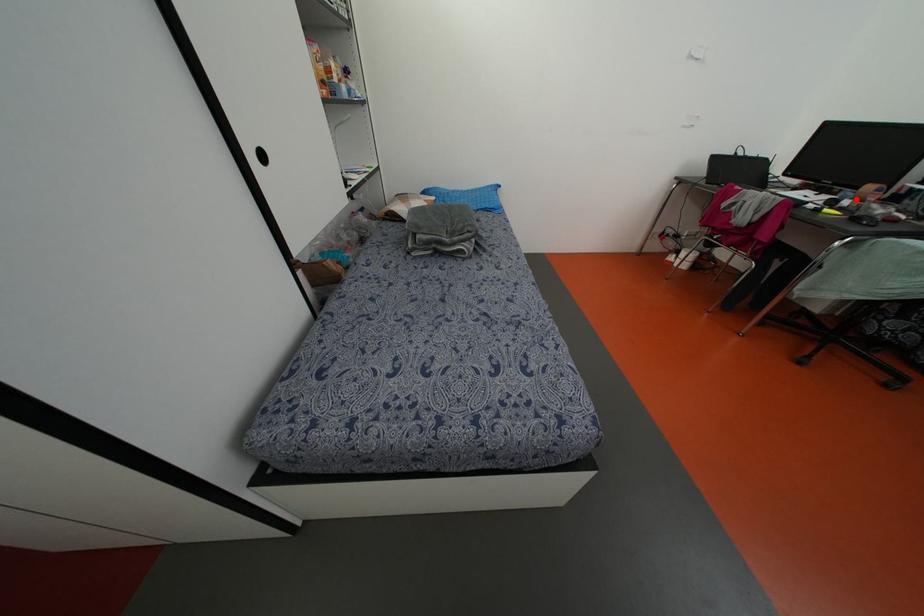
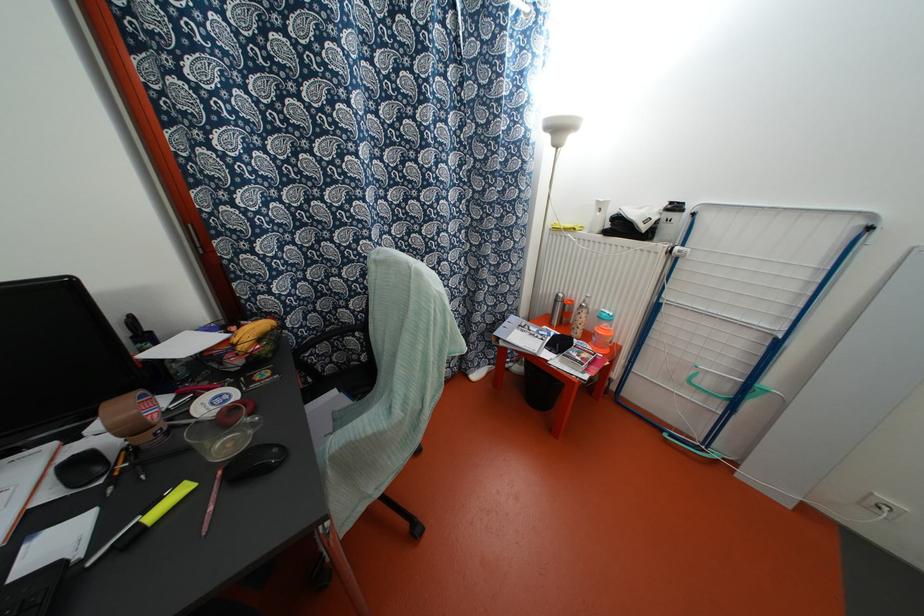
Find the pixel in the second image that matches the highlighted location in the first image.

(131, 429)